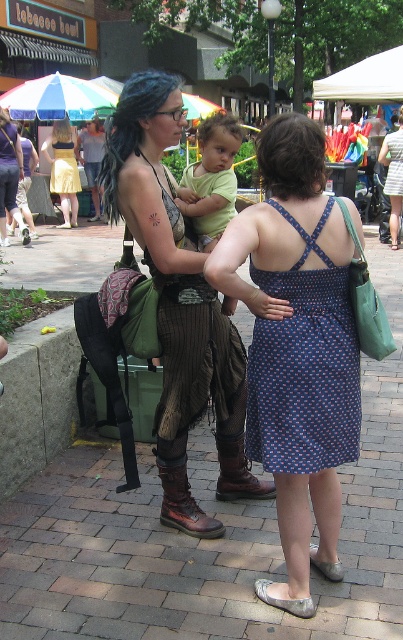
Question: Which point is closer to the camera taking this photo?

Choices:
 (A) (207, 189)
 (B) (66, 173)
 (C) (147, 100)

Answer: (C)

Question: Can you confirm if dark brown hair at upper center is positioned to the right of dark brown curly hair at center?

Choices:
 (A) yes
 (B) no

Answer: (A)

Question: Which point is farther to the camera?

Choices:
 (A) (118, 104)
 (B) (216, 113)
 (C) (294, 148)

Answer: (B)

Question: Is leather boots at center positioned at the back of dark brown hair at upper center?

Choices:
 (A) yes
 (B) no

Answer: (A)

Question: Which point is farther to the camera?

Choices:
 (A) (261, 368)
 (B) (103, 196)
 (C) (232, 468)
 (D) (274, 166)

Answer: (C)

Question: From the image, what is the correct spatial relationship of brick pavement at center in relation to dark brown hair at upper center?

Choices:
 (A) left
 (B) right

Answer: (B)